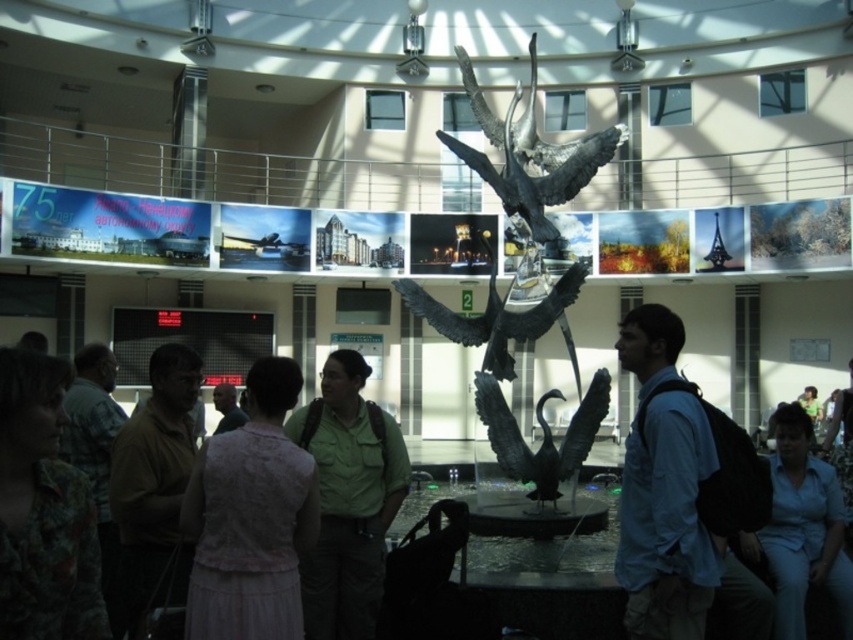
Is bronze sculpture at center bigger than pink lace dress at center?

Yes, bronze sculpture at center is bigger than pink lace dress at center.

Does bronze sculpture at center have a lesser height compared to pink lace dress at center?

In fact, bronze sculpture at center may be taller than pink lace dress at center.

Is point (538, 296) positioned behind point (225, 552)?

Yes, point (538, 296) is farther from viewer.

You are a GUI agent. You are given a task and a screenshot of the screen. Output one action in this format:
    pyautogui.click(x=<x>, y=<y>)
    Task: Click on the bronze sculpture at center
    This screenshot has height=640, width=853.
    Given the screenshot: What is the action you would take?
    pyautogui.click(x=524, y=280)

Measure the distance from floral fabric dress at lower left to light blue shirt at center.

floral fabric dress at lower left is 20.08 meters from light blue shirt at center.

Does floral fabric dress at lower left have a greater height compared to light blue shirt at center?

No, floral fabric dress at lower left is not taller than light blue shirt at center.

Who is more distant from viewer, (32,417) or (772,531)?

Positioned behind is point (772,531).

You are a GUI agent. You are given a task and a screenshot of the screen. Output one action in this format:
    pyautogui.click(x=<x>, y=<y>)
    Task: Click on the floral fabric dress at lower left
    The image size is (853, 640).
    Given the screenshot: What is the action you would take?
    pyautogui.click(x=44, y=512)

Does pink lace dress at center have a smaller size compared to green matte uniform at center?

Yes, pink lace dress at center is smaller than green matte uniform at center.

Can you confirm if pink lace dress at center is positioned to the right of green matte uniform at center?

In fact, pink lace dress at center is to the left of green matte uniform at center.

Measure the distance between point (257, 465) and camera.

The distance of point (257, 465) from camera is 69.70 feet.

Where is `pink lace dress at center`? pink lace dress at center is located at coordinates (251, 518).